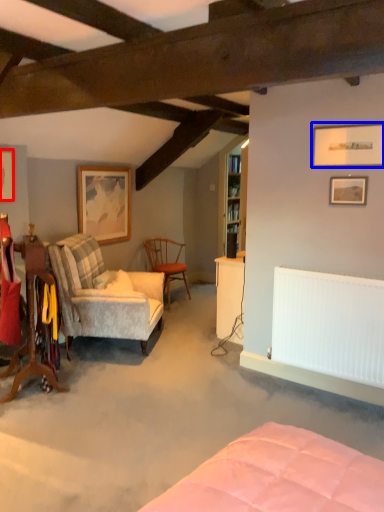
Question: Which of the following is the farthest to the observer, picture frame (highlighted by a red box) or picture frame (highlighted by a blue box)?

Choices:
 (A) picture frame
 (B) picture frame

Answer: (A)